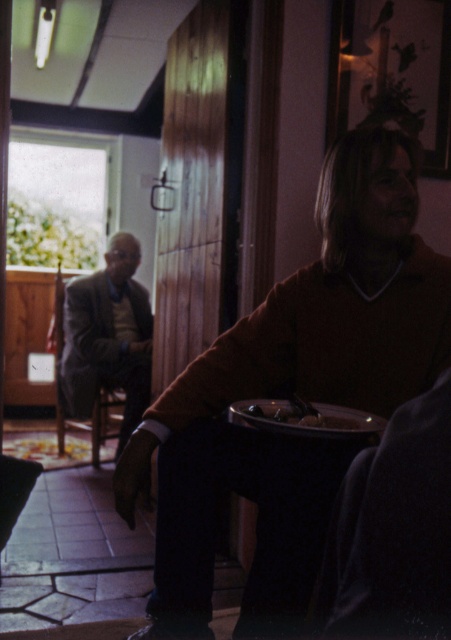
Does matte brown sweater at center come behind light brown woolen suit at left?

No.

Is matte brown sweater at center to the right of light brown woolen suit at left from the viewer's perspective?

Yes, matte brown sweater at center is to the right of light brown woolen suit at left.

Identify the location of matte brown sweater at center. The width and height of the screenshot is (451, 640). (294, 390).

This screenshot has width=451, height=640. What are the coordinates of `matte brown sweater at center` in the screenshot? It's located at (294, 390).

In the scene shown: Between matte brown sweater at center and shiny metallic bowl at center, which one is positioned higher?

matte brown sweater at center

Measure the distance between matte brown sweater at center and shiny metallic bowl at center.

matte brown sweater at center is 7.39 inches away from shiny metallic bowl at center.

Measure the distance between point (x=194, y=508) and camera.

Point (x=194, y=508) is 4.84 feet from camera.

You are a GUI agent. You are given a task and a screenshot of the screen. Output one action in this format:
    pyautogui.click(x=<x>, y=<y>)
    Task: Click on the matte brown sweater at center
    
    Given the screenshot: What is the action you would take?
    pyautogui.click(x=294, y=390)

Who is taller, light brown woolen suit at left or shiny metallic bowl at center?

Standing taller between the two is light brown woolen suit at left.

Is light brown woolen suit at left further to the viewer compared to shiny metallic bowl at center?

Yes, it is.

The height and width of the screenshot is (640, 451). Find the location of `light brown woolen suit at left`. light brown woolen suit at left is located at coordinates (107, 337).

Find the location of a particular element. The image size is (451, 640). light brown woolen suit at left is located at coordinates (107, 337).